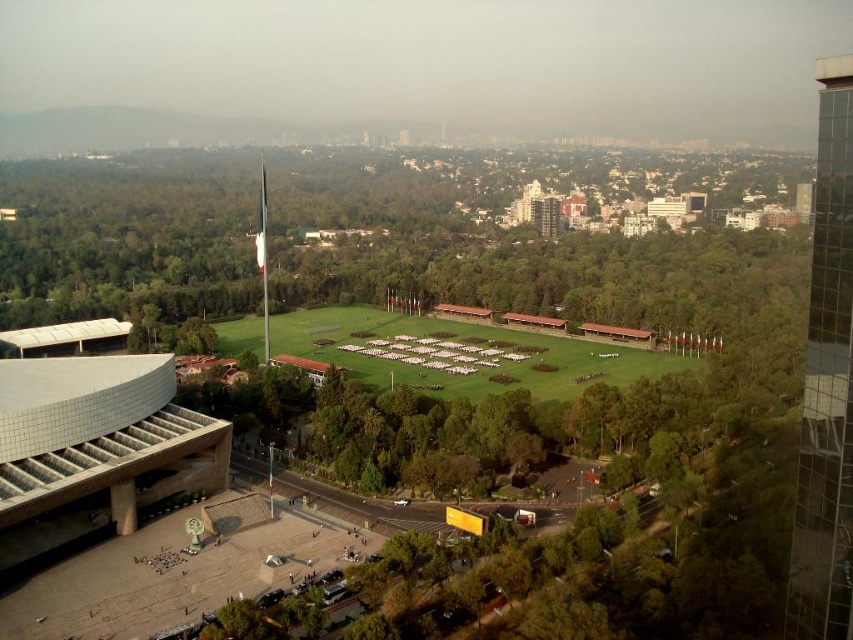
Question: Is the position of green leafy tree at center more distant than that of green grassy field at center?

Choices:
 (A) no
 (B) yes

Answer: (A)

Question: Is green leafy tree at center bigger than green grassy field at center?

Choices:
 (A) yes
 (B) no

Answer: (A)

Question: Can you confirm if green leafy tree at center is positioned to the left of green grassy field at center?

Choices:
 (A) no
 (B) yes

Answer: (B)